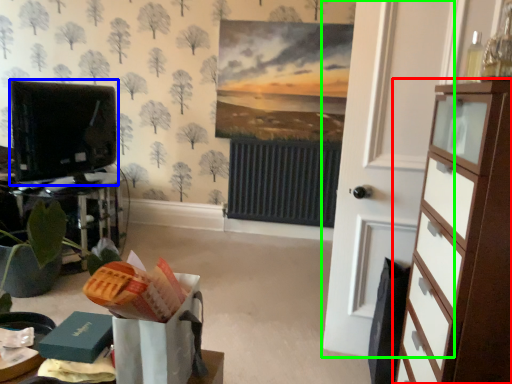
Question: Which object is the closest to the chest of drawers (highlighted by a red box)? Choose among these: electronic (highlighted by a blue box) or door (highlighted by a green box).

Choices:
 (A) electronic
 (B) door

Answer: (B)